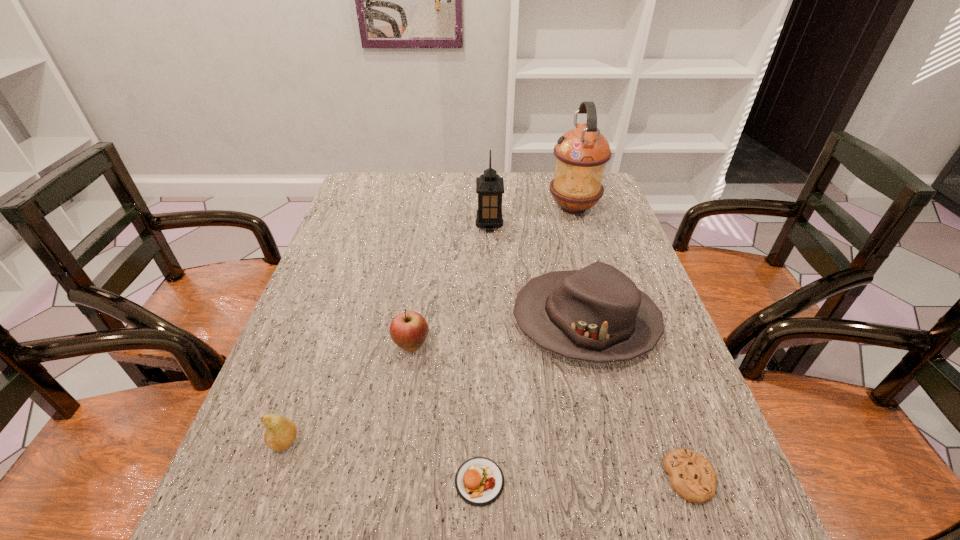
The width and height of the screenshot is (960, 540). What are the coordinates of `cookie at the right edge` in the screenshot? It's located at (692, 476).

This screenshot has height=540, width=960. I want to click on object at the far right corner, so click(581, 154).

The height and width of the screenshot is (540, 960). I want to click on vacant space at the far edge of the desktop, so click(437, 179).

The image size is (960, 540). I want to click on free space at the left edge of the desktop, so click(341, 220).

The image size is (960, 540). In order to click on free space at the right edge in this screenshot , I will do `click(574, 217)`.

The height and width of the screenshot is (540, 960). Identify the location of free space at the far left corner. (355, 199).

The image size is (960, 540). In the image, there is a desktop. In order to click on vacant space at the near left corner in this screenshot , I will do `click(276, 532)`.

In the image, there is a desktop. Where is `vacant space at the far right corner`? This screenshot has width=960, height=540. vacant space at the far right corner is located at coordinates (612, 199).

This screenshot has width=960, height=540. I want to click on free space that is in between the hat and the second object from left to right, so click(x=498, y=333).

The width and height of the screenshot is (960, 540). In order to click on vacant area between the oil lamp and the leftmost object in this screenshot , I will do `click(429, 325)`.